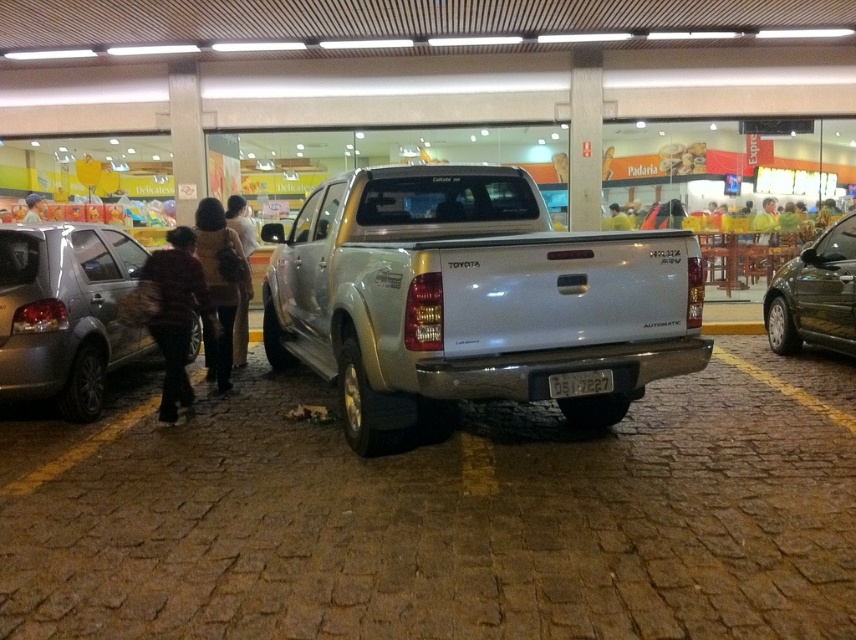
Question: Can you confirm if brown fabric bag at lower left is wider than brown fuzzy coat at left?

Choices:
 (A) no
 (B) yes

Answer: (B)

Question: Does silver metallic truck at center appear under silver metallic hatchback at left?

Choices:
 (A) yes
 (B) no

Answer: (A)

Question: Among these points, which one is nearest to the camera?

Choices:
 (A) (843, 250)
 (B) (214, 298)
 (C) (244, 221)
 (D) (590, 380)

Answer: (D)

Question: Which is farther from the black plastic license plate at center?

Choices:
 (A) brown fabric bag at lower left
 (B) brown fuzzy coat at center
 (C) silver metallic pickup truck at center
 (D) silver metallic truck at center

Answer: (B)

Question: Estimate the real-world distances between objects in this image. Which object is farther from the brown fuzzy coat at left?

Choices:
 (A) silver metallic hatchback at left
 (B) silver metallic pickup truck at center
 (C) silver metallic truck at center
 (D) shiny dark green car at right

Answer: (D)

Question: Where is silver metallic truck at center located in relation to shiny dark green car at right in the image?

Choices:
 (A) below
 (B) above

Answer: (A)